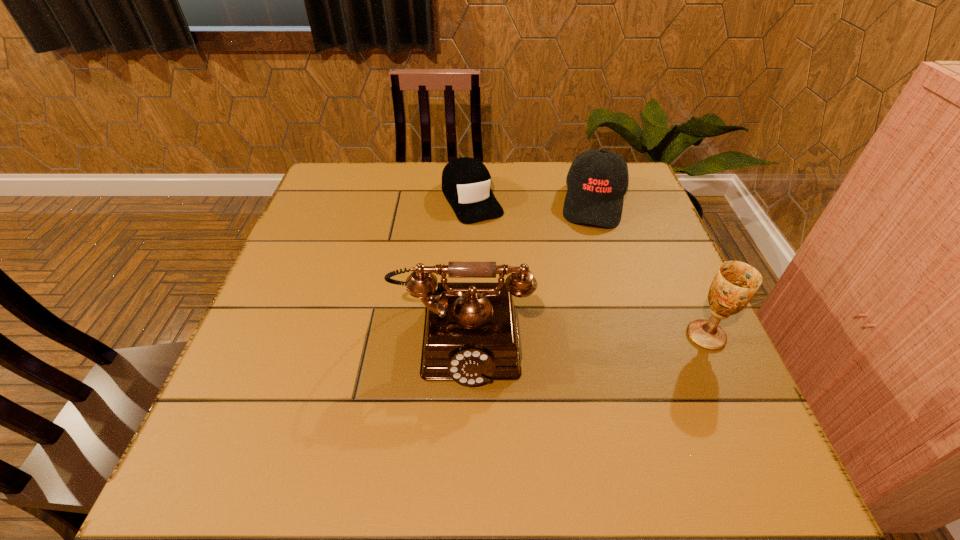
Identify the location of vacant space at the far edge. The width and height of the screenshot is (960, 540). (389, 204).

The height and width of the screenshot is (540, 960). In order to click on vacant area at the near edge in this screenshot , I will do `click(392, 415)`.

In the image, there is a desktop. At what (x,y) coordinates should I click in order to perform the action: click on vacant space at the right edge. Please return your answer as a coordinate pair (x, y). The image size is (960, 540). Looking at the image, I should click on (607, 252).

The image size is (960, 540). Find the location of `vacant space at the far left corner of the desktop`. vacant space at the far left corner of the desktop is located at coordinates [325, 181].

In the image, there is a desktop. Identify the location of vacant space at the near left corner. This screenshot has width=960, height=540. (306, 409).

Where is `vacant region between the shortest object and the rightmost object`? This screenshot has width=960, height=540. vacant region between the shortest object and the rightmost object is located at coordinates (588, 267).

Locate an element on the screen. free space between the tallest object and the chalice is located at coordinates (584, 335).

This screenshot has height=540, width=960. What are the coordinates of `empty space that is in between the third object from left to right and the cap` in the screenshot? It's located at (533, 201).

You are a GUI agent. You are given a task and a screenshot of the screen. Output one action in this format:
    pyautogui.click(x=<x>, y=<y>)
    Task: Click on the blank region between the third shortest object and the telephone
    
    Given the screenshot: What is the action you would take?
    pyautogui.click(x=584, y=335)

Locate an element on the screen. free space that is in between the third tallest object and the shortest object is located at coordinates (533, 201).